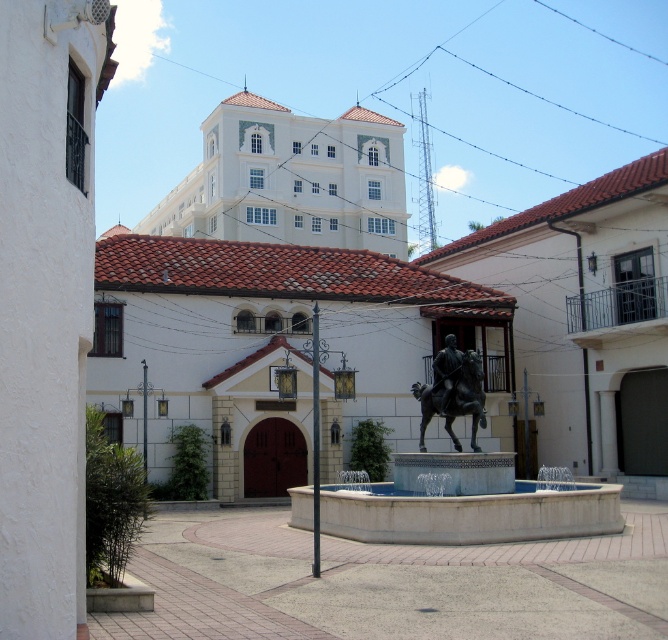
Question: Is gray concrete courtyard at center wider than polished bronze statue at center?

Choices:
 (A) yes
 (B) no

Answer: (A)

Question: Which object is positioned farthest from the white tile church at upper center?

Choices:
 (A) white marble fountain at center
 (B) gray concrete courtyard at center
 (C) bronze statue at center

Answer: (C)

Question: Does gray concrete courtyard at center appear under white marble fountain at center?

Choices:
 (A) no
 (B) yes

Answer: (B)

Question: Can you confirm if gray concrete courtyard at center is positioned to the left of white marble fountain at center?

Choices:
 (A) yes
 (B) no

Answer: (A)

Question: Which object appears farthest from the camera in this image?

Choices:
 (A) white tile church at upper center
 (B) polished bronze statue at center

Answer: (A)

Question: Estimate the real-world distances between objects in this image. Which object is closer to the gray concrete courtyard at center?

Choices:
 (A) white tile church at upper center
 (B) white marble fountain at center

Answer: (B)